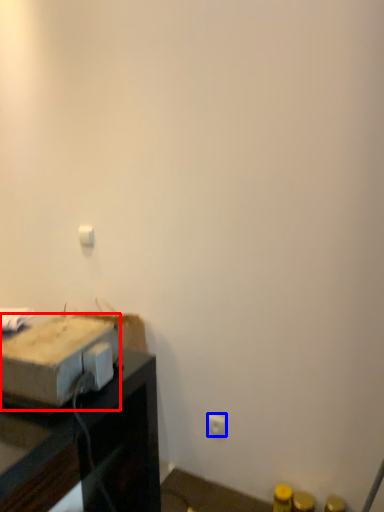
Question: Among these objects, which one is nearest to the camera, cardboard box (highlighted by a red box) or electric outlet (highlighted by a blue box)?

Choices:
 (A) cardboard box
 (B) electric outlet

Answer: (A)